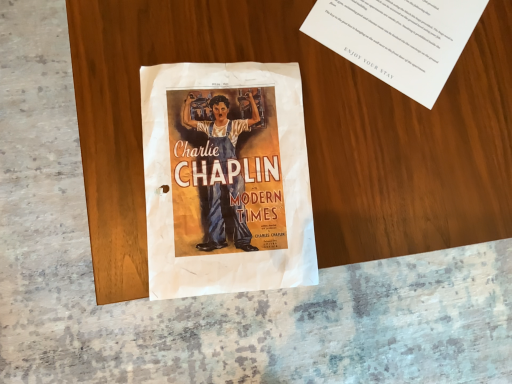
Find the location of a particular element. vacant space to the right of white paper at upper right is located at coordinates (483, 99).